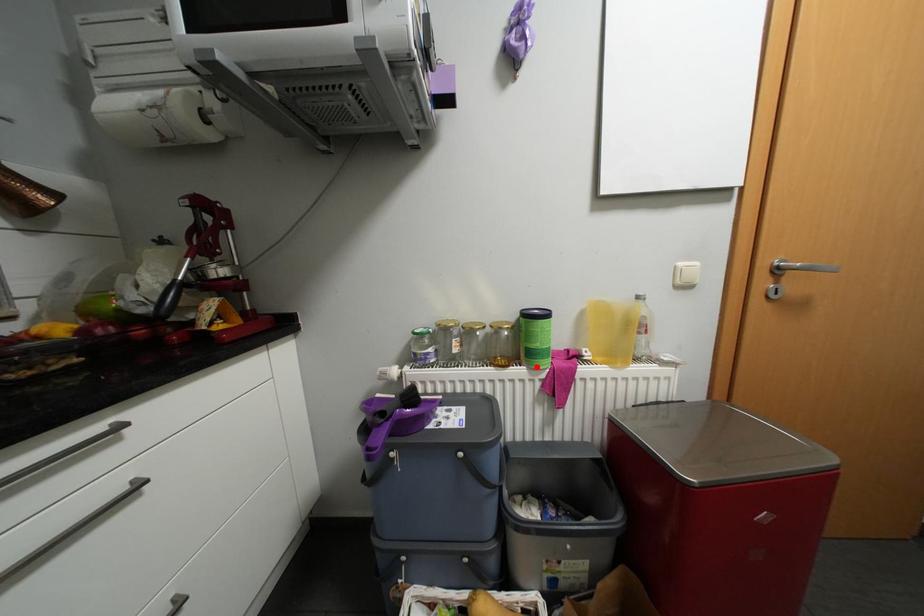
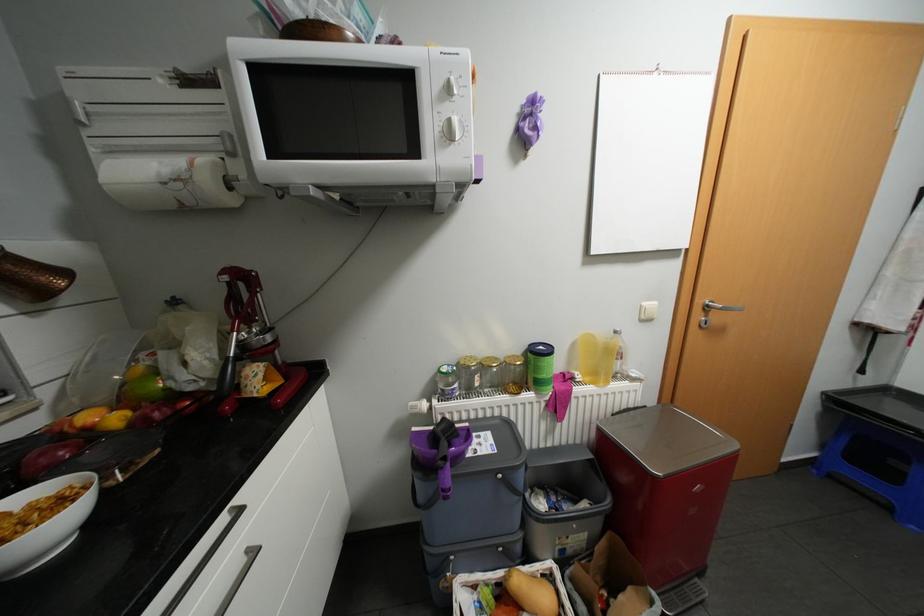
Find the pixel in the second image that matches the highlighted location in the first image.

(544, 392)